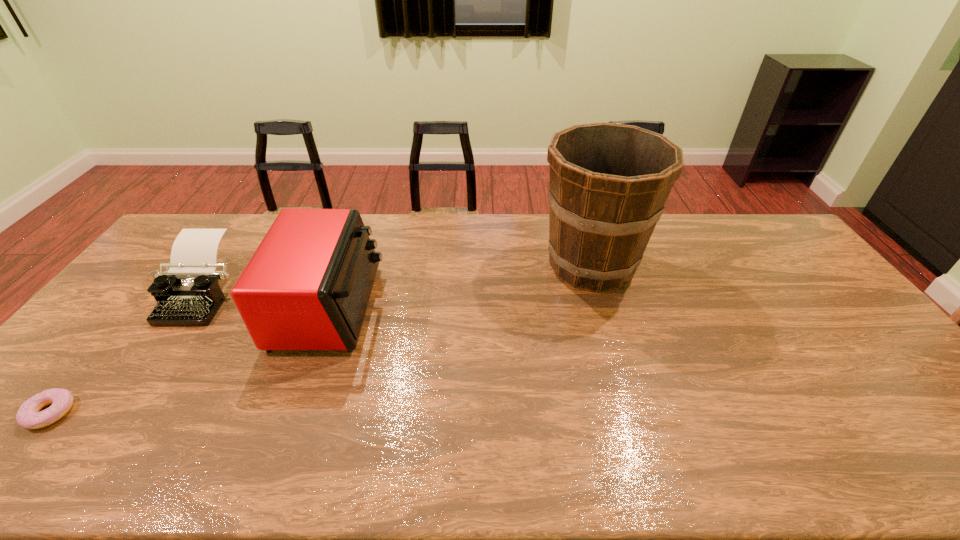
Locate an element on the screen. The width and height of the screenshot is (960, 540). the tallest object is located at coordinates (608, 183).

This screenshot has width=960, height=540. Identify the location of the rightmost object. (608, 183).

Locate an element on the screen. This screenshot has height=540, width=960. toaster oven is located at coordinates (307, 286).

This screenshot has width=960, height=540. Identify the location of the third object from left to right. (307, 286).

Identify the location of typewriter. This screenshot has width=960, height=540. (188, 293).

Identify the location of the nearest object. (28, 416).

Locate an element on the screen. the shortest object is located at coordinates (28, 416).

The height and width of the screenshot is (540, 960). I want to click on vacant region located 0.170m on the right of the tallest object, so click(697, 265).

At what (x,y) coordinates should I click in order to perform the action: click on free spot located 0.280m on the front-facing side of the third object from left to right. Please return your answer as a coordinate pair (x, y). Looking at the image, I should click on (469, 307).

This screenshot has height=540, width=960. I want to click on vacant space located on the keys of the typewriter, so click(x=91, y=449).